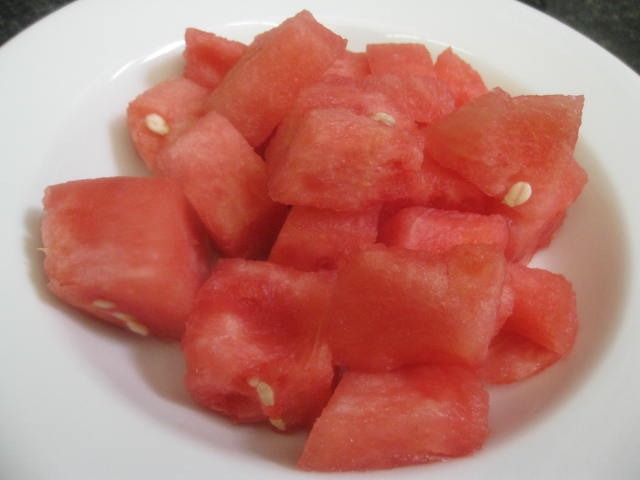
You are a GUI agent. You are given a task and a screenshot of the screen. Output one action in this format:
    pyautogui.click(x=<x>, y=<y>)
    Task: Click on the shadow on bowl
    This screenshot has width=640, height=480.
    Given the screenshot: What is the action you would take?
    pyautogui.click(x=610, y=254)